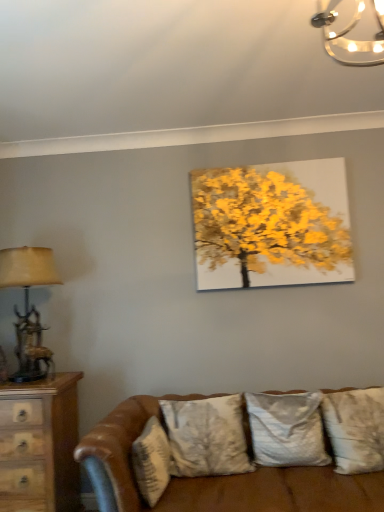
Question: Is silky white pillow at center, the 2th pillow viewed from the left, inside the boundaries of brown leather couch at lower center, or outside?

Choices:
 (A) inside
 (B) outside

Answer: (A)

Question: In terms of height, does silky white pillow at center, the third pillow viewed from the right, look taller or shorter compared to brown leather couch at lower center?

Choices:
 (A) tall
 (B) short

Answer: (B)

Question: Estimate the real-world distances between objects in this image. Which object is closer to the textured gray pillow at lower center, which is the 1th pillow from left to right?

Choices:
 (A) textured beige pillow at lower right, which is counted as the 4th pillow, starting from the left
 (B) antler bronze table lamp at left
 (C) silky white pillow at center, the 2th pillow viewed from the left
 (D) wooden chest of drawers at left
 (E) metallic glass chandelier at upper right

Answer: (C)

Question: Which object is the farthest from the silky gray pillow at center, which appears as the third pillow when viewed from the left?

Choices:
 (A) textured beige pillow at lower right, the 1th pillow when ordered from right to left
 (B) textured gray pillow at lower center, positioned as the fourth pillow in right-to-left order
 (C) metallic glass chandelier at upper right
 (D) antler bronze table lamp at left
 (E) brown leather couch at lower center

Answer: (C)